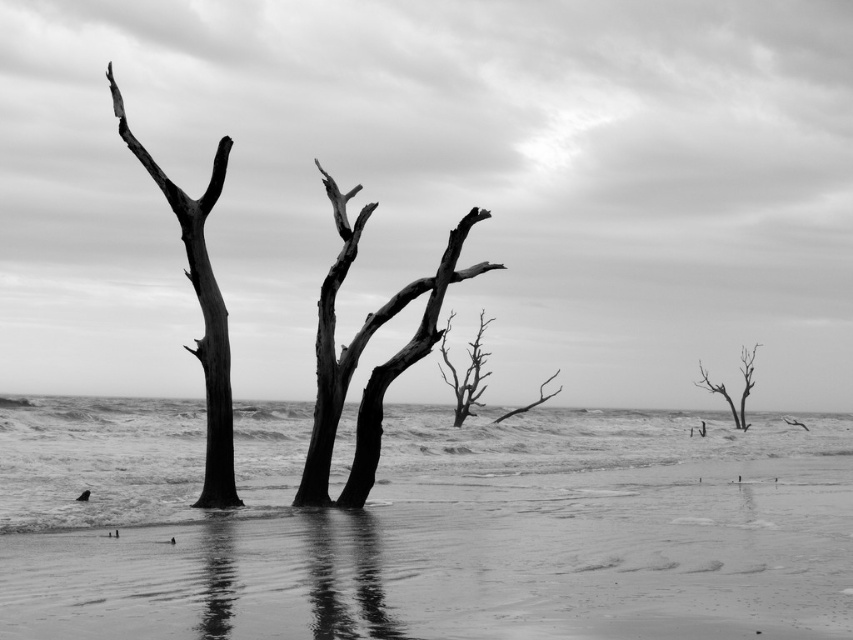
You are a photographer standing at the shoreline in this coastal scene. You want to capture a photo of both the dead wood tree at center and the smooth bark tree at right. Which tree should you position closer to the left side of your camera frame to include both in the shot?

The dead wood tree at center is to the left of the smooth bark tree at right, so to include both in the shot, position the dead wood tree at center closer to the left side of your camera frame.

You are standing at the shoreline in this coastal scene. You see the smooth water at center and the dead wood tree at center. Which object is closer to the horizon?

The smooth water at center is below the dead wood tree at center, so the dead wood tree at center is closer to the horizon.